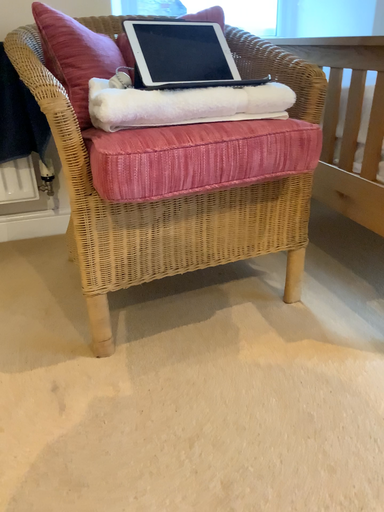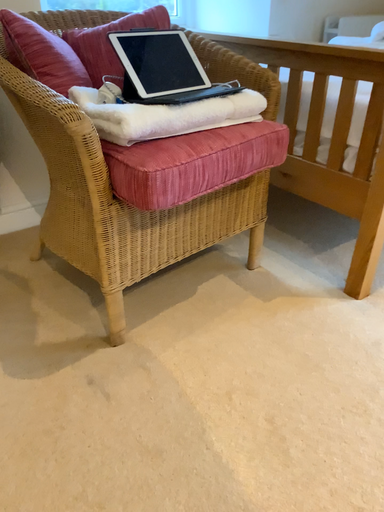
Question: How did the camera likely rotate when shooting the video?

Choices:
 (A) rotated right
 (B) rotated left

Answer: (A)